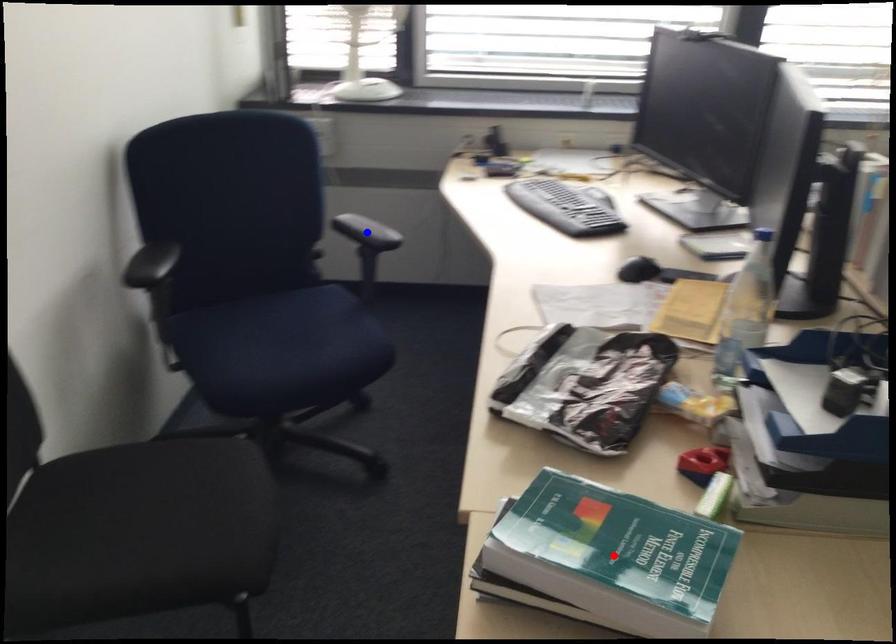
Question: In the image, two points are highlighted. Which point is nearer to the camera? Reply with the corresponding letter.

Choices:
 (A) blue point
 (B) red point

Answer: (B)